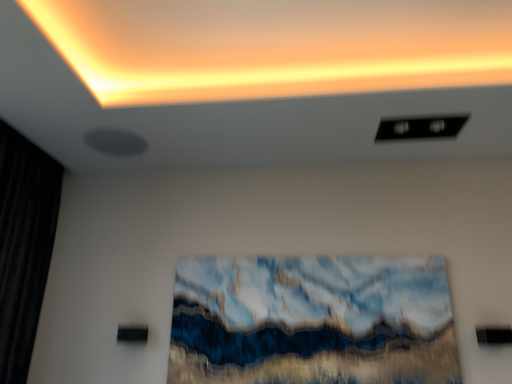
Question: Considering the relative positions of textured blue and white abstract painting at center and black fabric curtain at left in the image provided, is textured blue and white abstract painting at center to the left or to the right of black fabric curtain at left?

Choices:
 (A) left
 (B) right

Answer: (B)

Question: Considering the positions of point (x=321, y=286) and point (x=23, y=276), is point (x=321, y=286) closer or farther from the camera than point (x=23, y=276)?

Choices:
 (A) farther
 (B) closer

Answer: (B)

Question: Based on their relative distances, which object is nearer to the black fabric curtain at left?

Choices:
 (A) textured blue and white abstract painting at center
 (B) matte orange glow at upper center

Answer: (B)

Question: Based on their relative distances, which object is nearer to the black fabric curtain at left?

Choices:
 (A) textured blue and white abstract painting at center
 (B) matte orange glow at upper center

Answer: (B)